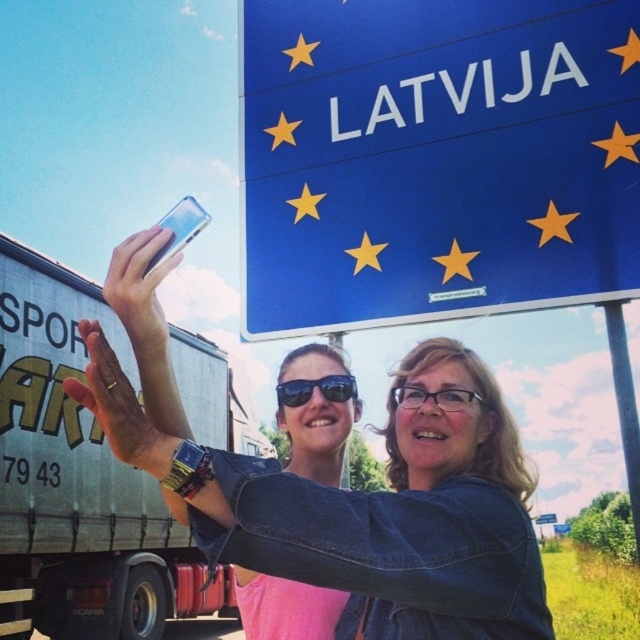
Based on the photo, how much distance is there between sunglasses at center and blue plastic road sign at upper center?

sunglasses at center is 24.01 meters away from blue plastic road sign at upper center.

I want to click on sunglasses at center, so click(317, 387).

Is point (576, 230) positioned before point (547, 515)?

Yes, it is.

Between point (556, 252) and point (548, 513), which one is positioned behind?

Point (548, 513)

Is point (472, 276) closer to viewer compared to point (552, 518)?

That is True.

Identify the location of blue glossy sign at upper center. (435, 157).

Does blue glossy sign at upper center appear over denim jacket at center?

Correct, blue glossy sign at upper center is located above denim jacket at center.

Is point (556, 218) positioned behind point (88, 397)?

Yes, it is.

Between point (486, 134) and point (468, 451), which one is positioned behind?

Positioned behind is point (486, 134).

The width and height of the screenshot is (640, 640). I want to click on blue glossy sign at upper center, so click(x=435, y=157).